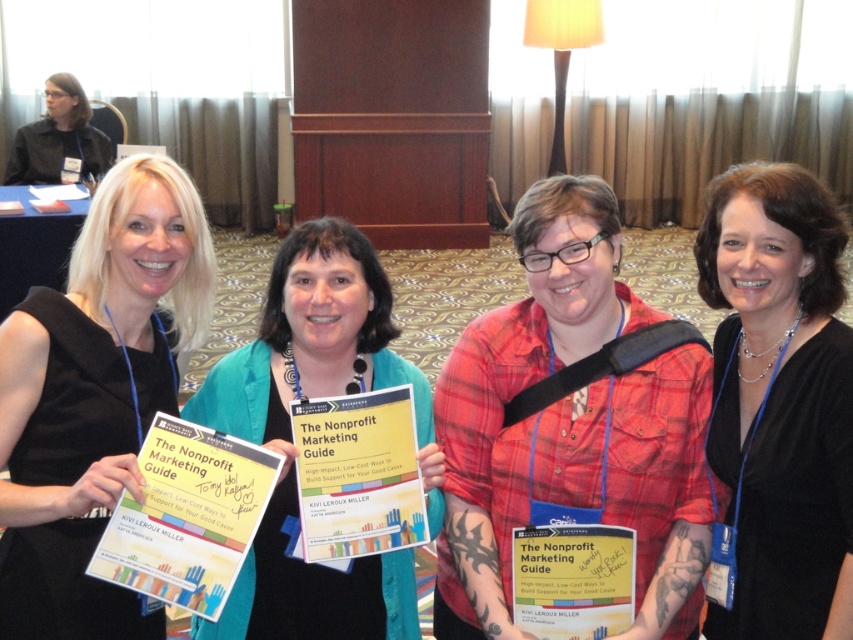
Does red plaid shirt at center have a lesser width compared to matte black jacket at upper left?

Yes, red plaid shirt at center is thinner than matte black jacket at upper left.

You are a GUI agent. You are given a task and a screenshot of the screen. Output one action in this format:
    pyautogui.click(x=<x>, y=<y>)
    Task: Click on the red plaid shirt at center
    This screenshot has height=640, width=853.
    Given the screenshot: What is the action you would take?
    pyautogui.click(x=570, y=428)

Where is `red plaid shirt at center`? red plaid shirt at center is located at coordinates (570, 428).

Is red plaid shirt at center wider than black fabric dress at left?

Indeed, red plaid shirt at center has a greater width compared to black fabric dress at left.

Can you confirm if red plaid shirt at center is positioned to the left of black fabric dress at left?

In fact, red plaid shirt at center is to the right of black fabric dress at left.

The width and height of the screenshot is (853, 640). What are the coordinates of `red plaid shirt at center` in the screenshot? It's located at pyautogui.click(x=570, y=428).

Is black fabric dress at left behind matte black jacket at upper left?

No.

Is point (108, 250) positioned before point (88, 129)?

Yes.

At what (x,y) coordinates should I click in order to perform the action: click on black fabric dress at left. Please return your answer as a coordinate pair (x, y). Image resolution: width=853 pixels, height=640 pixels. Looking at the image, I should click on 96,397.